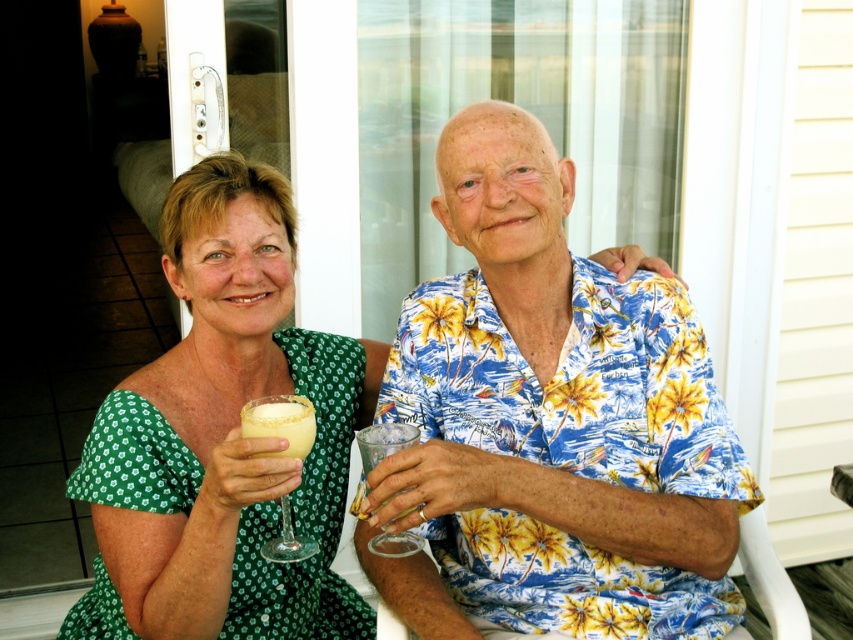
You are a bartender who needs to serve drinks to the two people in the image. The person wearing the blue floral shirt at center is seated above the clear glass wine glass at center. Where should you place the next drink to ensure it is within easy reach for both?

The blue floral shirt at center is located above the clear glass wine glass at center, so placing the next drink near the clear glass wine glass at center would ensure it is within easy reach for both individuals.

In the scene shown: You are a photographer standing in front of the glass door. You want to take a photo of the blue floral shirt at center and the transparent glass at right. Which object should you focus on first to ensure both are in clear focus?

You should focus on the blue floral shirt at center first because it is closer to the viewer than the transparent glass at right, ensuring both will be in focus when using a camera with proper depth of field.

From the picture: You are standing outside the glass door and want to locate the point at coordinates (223, 438). Where should you look relative to the green floral dress at center?

The point at coordinates (223, 438) is located on the green floral dress at center.